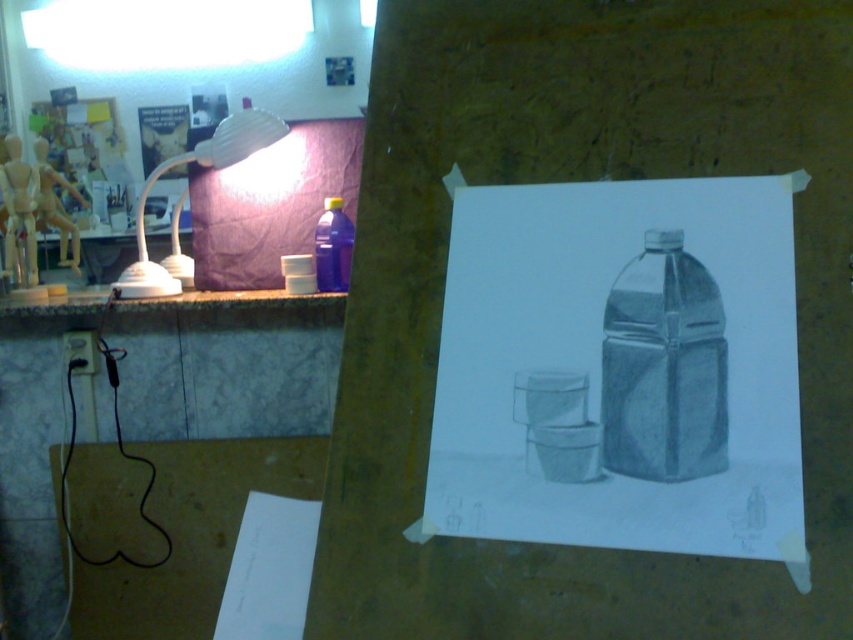
Question: Does matte gray plastic bottle at center appear over marble-like stone counter at left?

Choices:
 (A) no
 (B) yes

Answer: (A)

Question: Is matte gray plastic bottle at center positioned at the back of marble-like stone counter at left?

Choices:
 (A) no
 (B) yes

Answer: (A)

Question: Does gray paper at center have a smaller size compared to white paper at lower left?

Choices:
 (A) no
 (B) yes

Answer: (A)

Question: Which of the following is the closest to the observer?

Choices:
 (A) (321, 253)
 (B) (251, 141)
 (C) (587, 232)

Answer: (C)

Question: Which is nearer to the matte gray plastic bottle at center?

Choices:
 (A) white paper at lower left
 (B) marble-like stone counter at left
 (C) translucent blue plastic bottle at upper center

Answer: (A)

Question: Based on their relative distances, which object is farther from the translucent blue plastic bottle at upper center?

Choices:
 (A) white paper at lower left
 (B) gray paper at center
 (C) marble-like stone counter at left

Answer: (B)